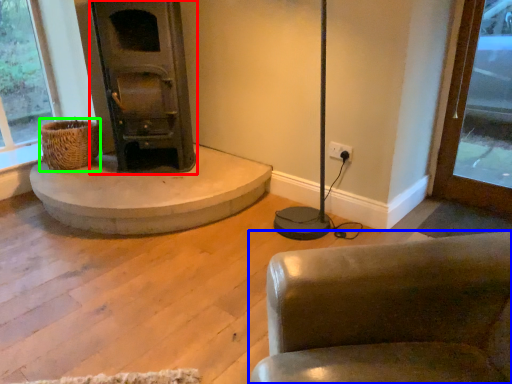
Question: Estimate the real-world distances between objects in this image. Which object is farther from wood burning stove (highlighted by a red box), chair (highlighted by a blue box) or basket (highlighted by a green box)?

Choices:
 (A) chair
 (B) basket

Answer: (A)